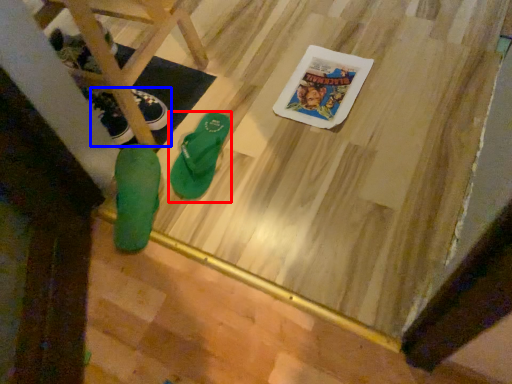
Question: Which object is closer to the camera taking this photo, footwear (highlighted by a red box) or footwear (highlighted by a blue box)?

Choices:
 (A) footwear
 (B) footwear

Answer: (A)